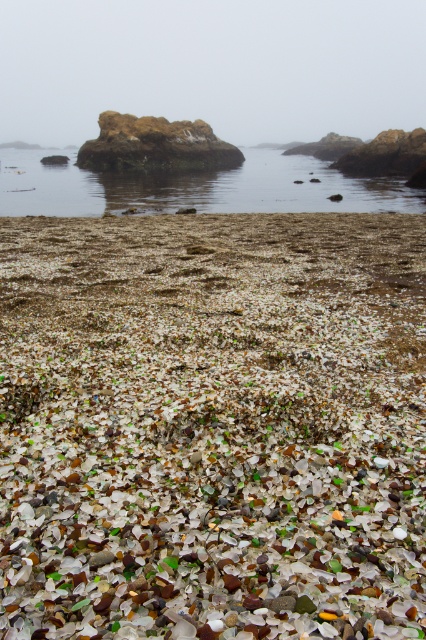
Question: Which of the following is the closest to the observer?

Choices:
 (A) rusty stone rock at center
 (B) translucent glass pebbles at center

Answer: (B)

Question: Which of the following is the closest to the observer?

Choices:
 (A) (127, 358)
 (B) (86, 198)

Answer: (A)

Question: Can you confirm if translucent glass pebbles at center is positioned to the right of clear water at center?

Choices:
 (A) no
 (B) yes

Answer: (B)

Question: Is clear water at center bigger than rusty stone rock at center?

Choices:
 (A) no
 (B) yes

Answer: (B)

Question: Is translucent glass pebbles at center to the right of rusty stone rock at center from the viewer's perspective?

Choices:
 (A) yes
 (B) no

Answer: (A)

Question: Which object appears farthest from the camera in this image?

Choices:
 (A) translucent glass pebbles at center
 (B) rusty stone rock at center
 (C) clear water at center

Answer: (B)